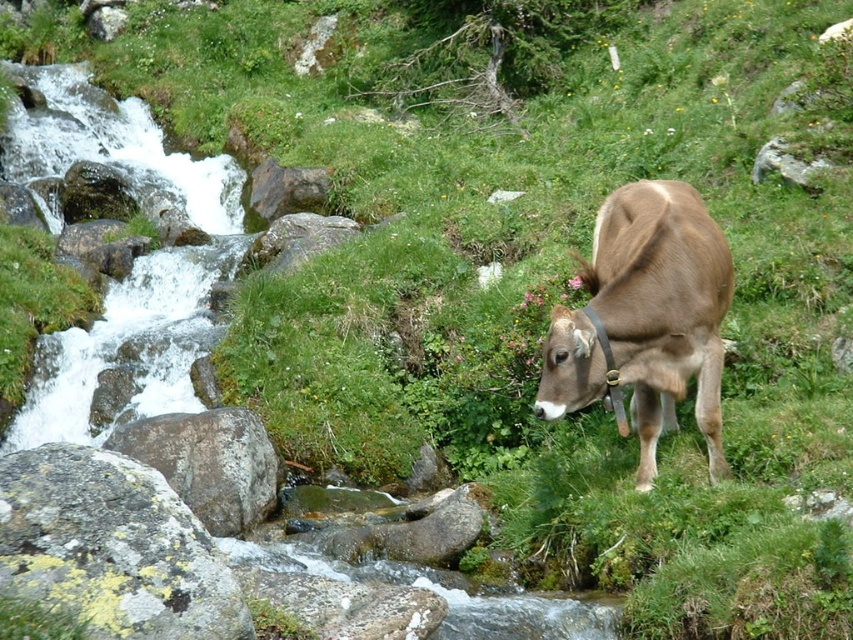
Question: Observing the image, what is the correct spatial positioning of brown leather cow at right in reference to gray rough rock at lower left?

Choices:
 (A) below
 (B) above

Answer: (B)

Question: Does gray rough rock at lower left have a greater width compared to gray rock at upper right?

Choices:
 (A) no
 (B) yes

Answer: (B)

Question: Which object is positioned farthest from the gray rock at upper right?

Choices:
 (A) gray rough rock at lower left
 (B) brown leather cow at right

Answer: (A)

Question: Which is nearer to the gray rock at upper right?

Choices:
 (A) speckled gray rock at left
 (B) gray rough rock at lower left

Answer: (B)

Question: Is speckled gray rock at left positioned behind gray rough rock at lower left?

Choices:
 (A) no
 (B) yes

Answer: (A)

Question: Which point is farther to the camera?

Choices:
 (A) (146, 456)
 (B) (804, 163)

Answer: (B)